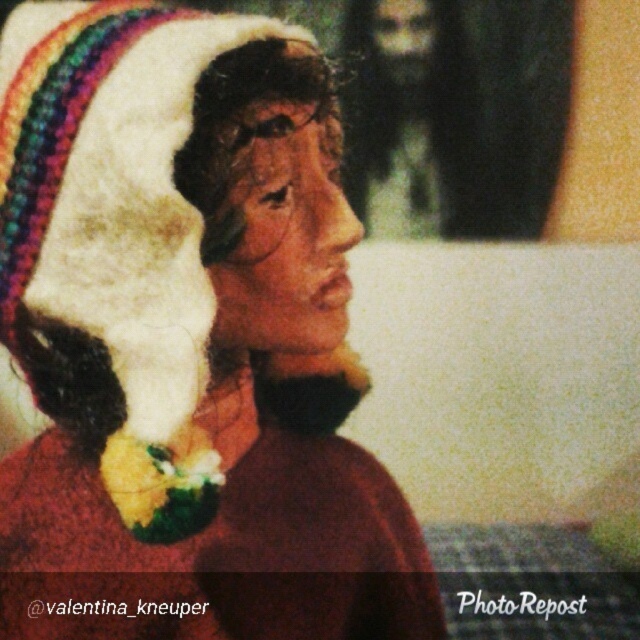
You are a photographer trying to capture a portrait of the bearded man at upper center and the beige fabric head at upper center. Based on their widths, which subject should you focus on to ensure they fit within the frame without cropping?

The bearded man at upper center has a greater width than the beige fabric head at upper center. To ensure both fit within the frame without cropping, focus on the bearded man at upper center as the primary subject since it requires more space.

You are a photographer trying to capture a closeup of the person in the image. You notice the white knitted hat at upper left and the beige fabric head at upper center. Which object should you focus on to ensure it fits entirely within your camera frame if your current frame is narrower than the width of the wider object?

You should focus on the beige fabric head at upper center because the white knitted hat at upper left might be wider than the beige fabric head at upper center, so the beige fabric head is likely narrower and will fit within the frame.

You are a photographer trying to adjust the lighting for a portrait. You notice the white knitted hat at upper left and the bearded man at upper center in the frame. Which object should you focus on to ensure proper exposure if the hat is too dark?

The white knitted hat at upper left has a lesser height compared to the bearded man at upper center, so focusing on the bearded man at upper center might help balance the exposure since it occupies more space in the frame.